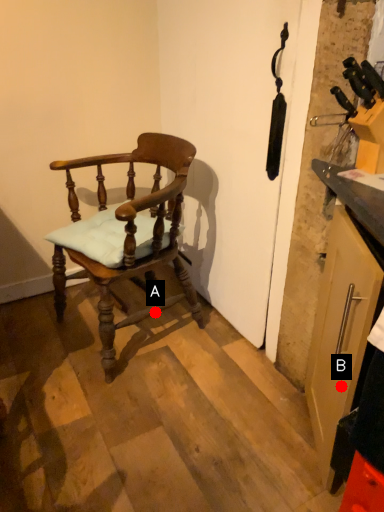
Question: Two points are circled on the image, labeled by A and B beside each circle. Which point is farther from the camera taking this photo?

Choices:
 (A) A is further
 (B) B is further

Answer: (A)